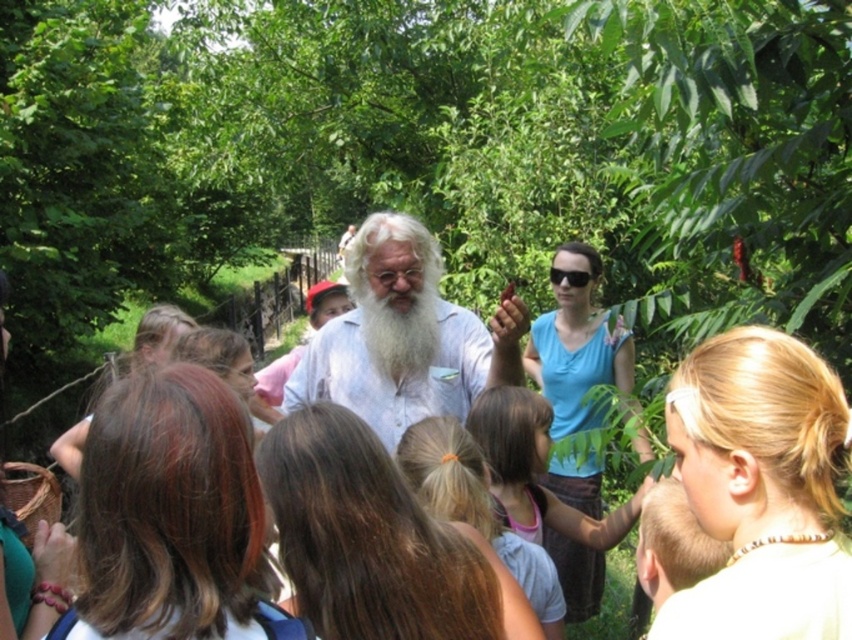
You are a photographer trying to capture a closeup of the black plastic sunglasses at center. However, the whitewoollybeard at center is blocking your view. Can you move to the right or left to get a clear shot without moving the objects?

Since the whitewoollybeard at center is to the left of black plastic sunglasses at center, moving to the right would allow you to get a clear shot without obstruction.

You are a photographer trying to capture a clear photo of both the white cotton shirt at center and the blonde hair at center. Since you want to focus on the details of both, which object should you adjust your camera focus to prioritize due to their size difference?

The white cotton shirt at center has a larger size compared to blonde hair at center, so you should prioritize focusing on the white cotton shirt at center to ensure its details are clear.